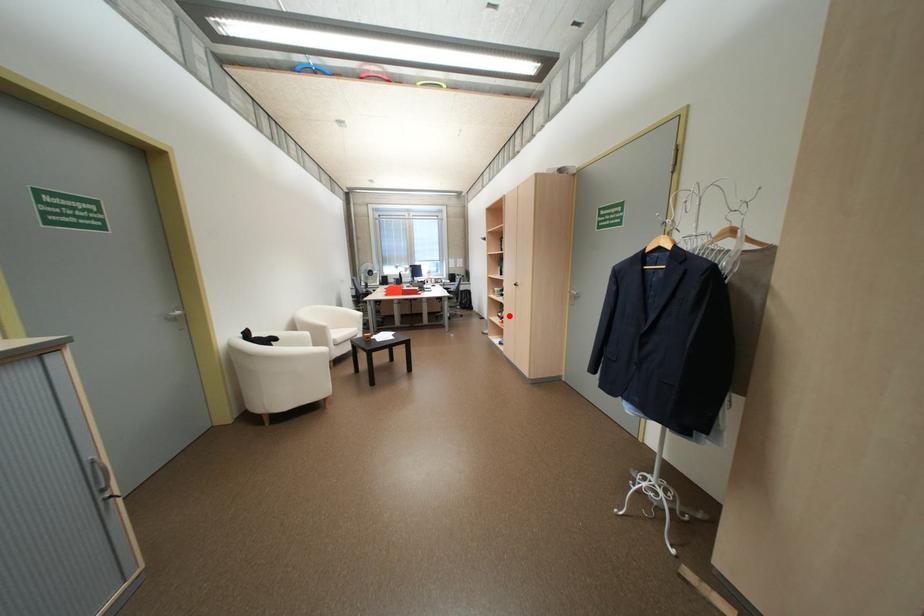
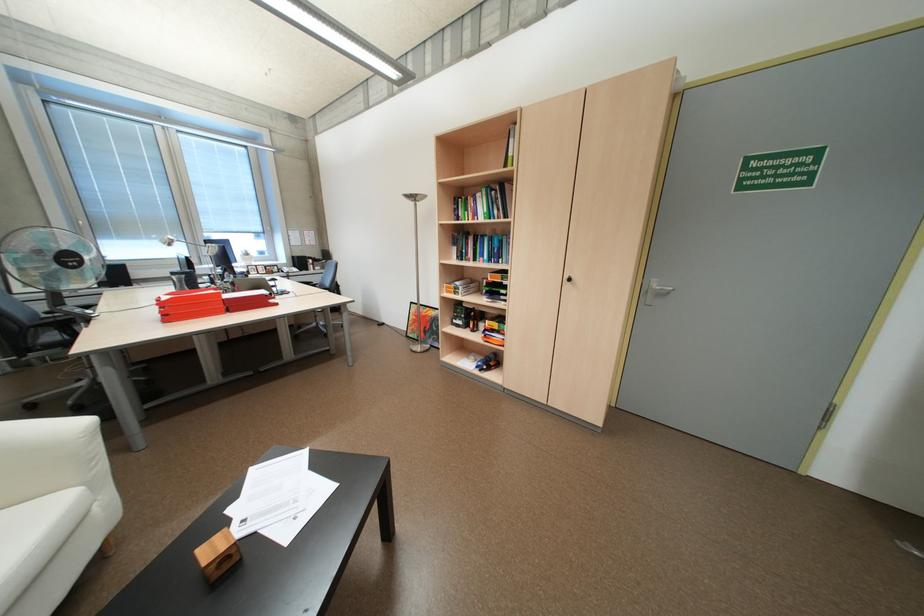
Question: I am providing you with two images of the same scene from different viewpoints. Given a red point in image1, look at the same physical point in image2. Is it:

Choices:
 (A) Closer to the viewpoint
 (B) Farther from the viewpoint

Answer: (B)